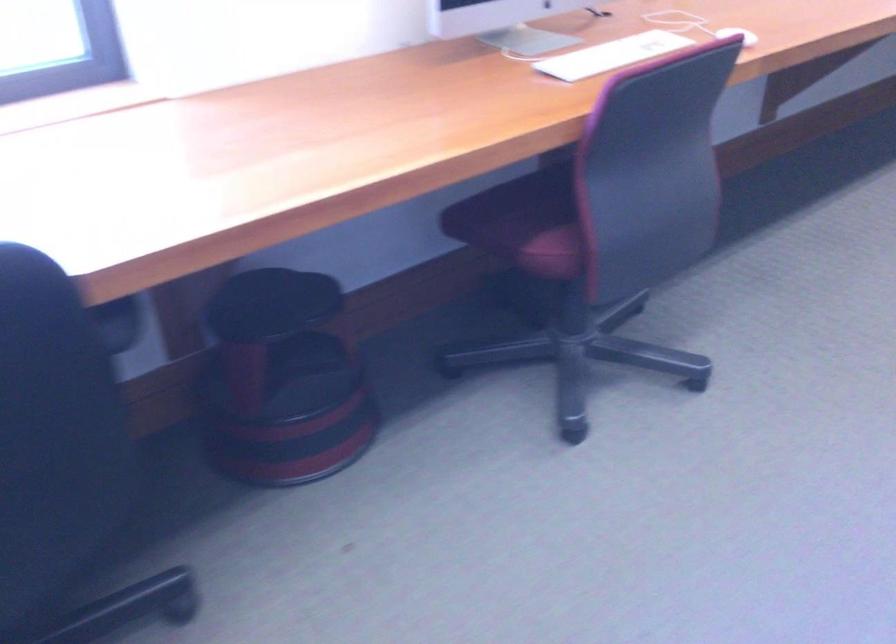
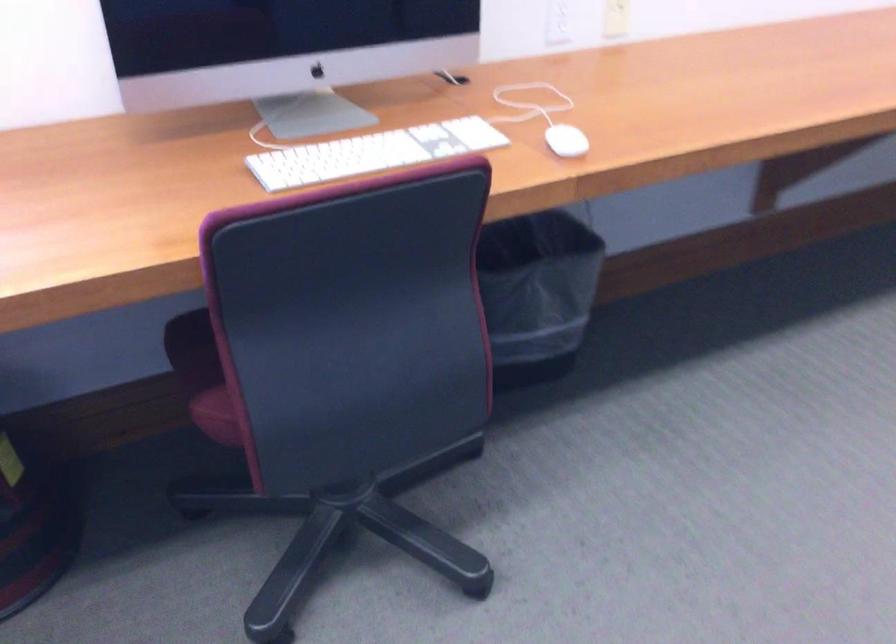
The images are taken continuously from a first-person perspective. In which direction are you moving?

The cameraman walked toward right, forward.